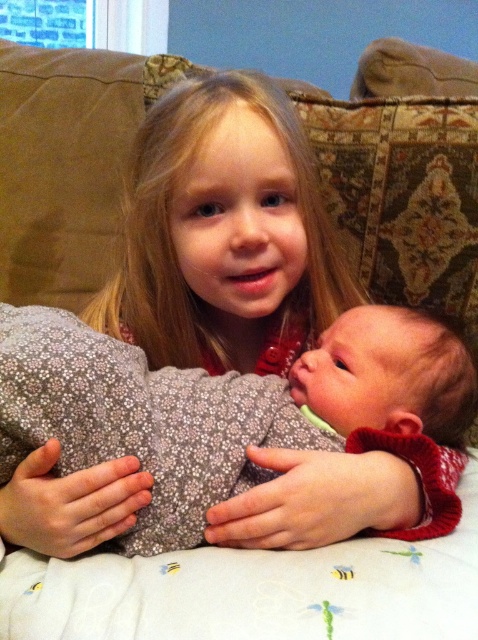
Question: Which point appears farthest from the camera in this image?

Choices:
 (A) (265, 93)
 (B) (294, 404)

Answer: (A)

Question: Does fluffy gray blanket at center appear on the right side of blonde hair at upper center?

Choices:
 (A) yes
 (B) no

Answer: (A)

Question: Among these points, which one is nearest to the camera?

Choices:
 (A) [364, 378]
 (B) [292, 116]

Answer: (A)

Question: Is fluffy gray blanket at center above blonde hair at upper center?

Choices:
 (A) no
 (B) yes

Answer: (A)

Question: Does fluffy gray blanket at center have a larger size compared to blonde hair at upper center?

Choices:
 (A) no
 (B) yes

Answer: (A)